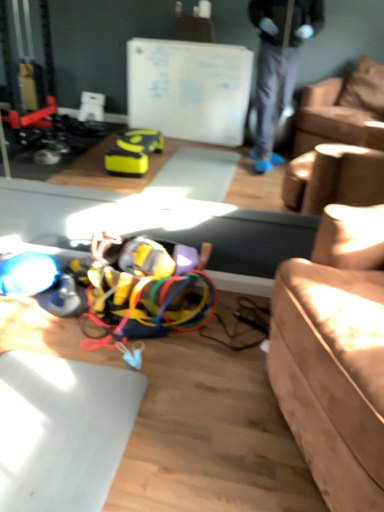
Question: Which is correct: multicolored plastic wires at center is inside leather couch at right, or outside of it?

Choices:
 (A) outside
 (B) inside

Answer: (A)

Question: In the image, is multicolored plastic wires at center on the left side or the right side of leather couch at right?

Choices:
 (A) right
 (B) left

Answer: (B)

Question: Is multicolored plastic wires at center bigger or smaller than leather couch at right?

Choices:
 (A) small
 (B) big

Answer: (A)

Question: From their relative heights in the image, would you say leather couch at right is taller or shorter than multicolored plastic wires at center?

Choices:
 (A) short
 (B) tall

Answer: (B)

Question: Is leather couch at right in front of or behind multicolored plastic wires at center in the image?

Choices:
 (A) front
 (B) behind

Answer: (A)

Question: From a real-world perspective, is leather couch at right above or below multicolored plastic wires at center?

Choices:
 (A) above
 (B) below

Answer: (A)

Question: Is point (321, 304) closer or farther from the camera than point (127, 323)?

Choices:
 (A) closer
 (B) farther

Answer: (A)